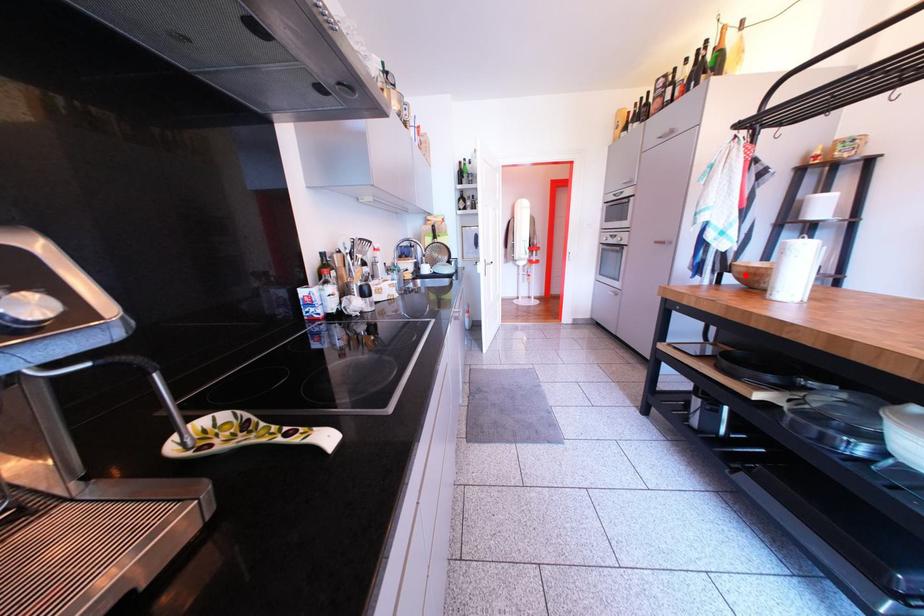
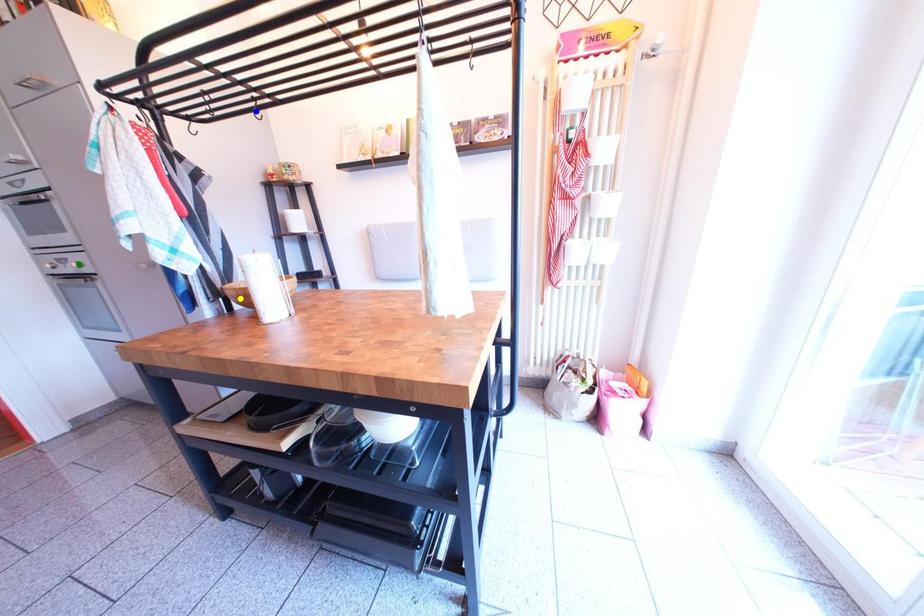
Question: I am providing you with two images of the same scene from different viewpoints. A red point is marked on the first image. You are given multiple points on the second image. In image 2, which mark is for the same physical point as the one in image 1?

Choices:
 (A) green point
 (B) blue point
 (C) yellow point

Answer: (C)